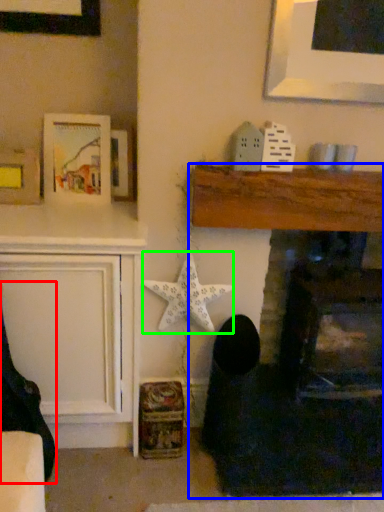
Question: Estimate the real-world distances between objects in this image. Which object is closer to rocking chair (highlighted by a red box), fireplace (highlighted by a blue box) or starfish (highlighted by a green box)?

Choices:
 (A) fireplace
 (B) starfish

Answer: (B)